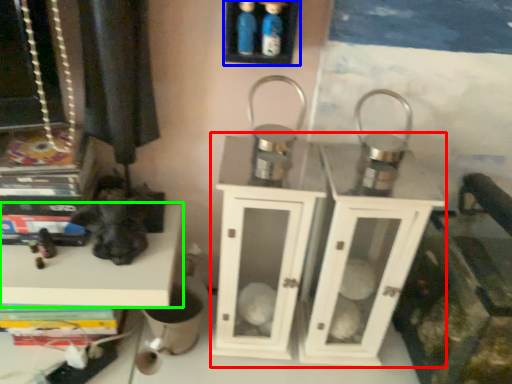
Question: Which object is positioned farthest from dresser (highlighted by a red box)? Select from shelf (highlighted by a blue box) and shelf (highlighted by a green box).

Choices:
 (A) shelf
 (B) shelf

Answer: (A)